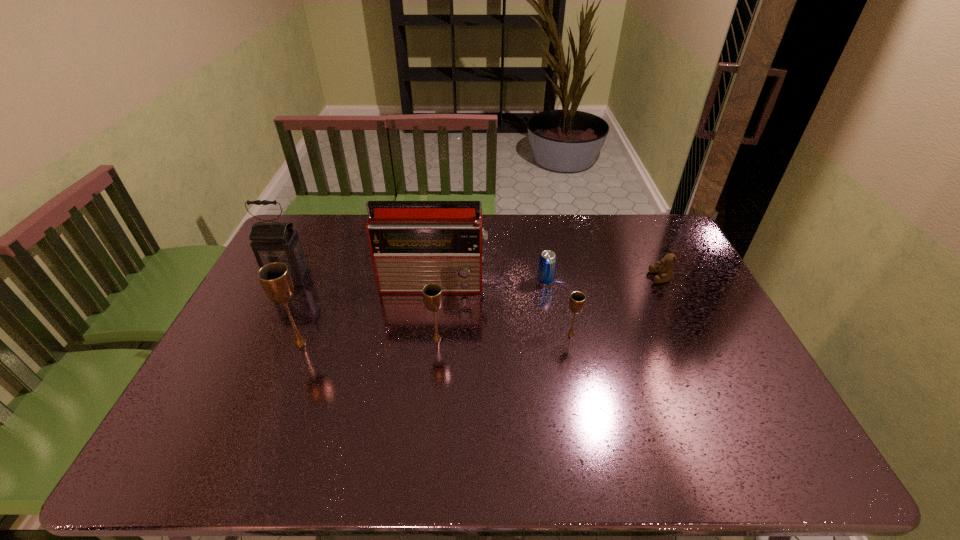
What are the coordinates of `free space located 0.310m on the right of the sixth object from right to left` in the screenshot? It's located at (423, 342).

Locate an element on the screen. This screenshot has height=540, width=960. free point located on the left of the second chalice from left to right is located at coordinates (300, 339).

Where is `vacant space located on the back of the fifth tallest object`? This screenshot has height=540, width=960. vacant space located on the back of the fifth tallest object is located at coordinates (556, 262).

Identify the location of free space located 0.280m on the front-facing side of the teddy bear. The image size is (960, 540). (565, 278).

What are the coordinates of `free space located 0.230m on the front-facing side of the teddy bear` in the screenshot? It's located at pos(580,278).

You are a GUI agent. You are given a task and a screenshot of the screen. Output one action in this format:
    pyautogui.click(x=<x>, y=<y>)
    Task: Click on the free space located 0.100m on the front-facing side of the teddy bear
    The height and width of the screenshot is (540, 960).
    Given the screenshot: What is the action you would take?
    pyautogui.click(x=620, y=278)

The width and height of the screenshot is (960, 540). I want to click on free location located on the front-facing side of the radio receiver, so click(420, 403).

Locate an element on the screen. The image size is (960, 540). free space located 0.190m on the left of the beer can is located at coordinates (478, 281).

Where is `vacant area situated 0.400m on the front-facing side of the lantern`? vacant area situated 0.400m on the front-facing side of the lantern is located at coordinates (230, 396).

Locate an element on the screen. Image resolution: width=960 pixels, height=540 pixels. object that is at the left edge is located at coordinates (271, 242).